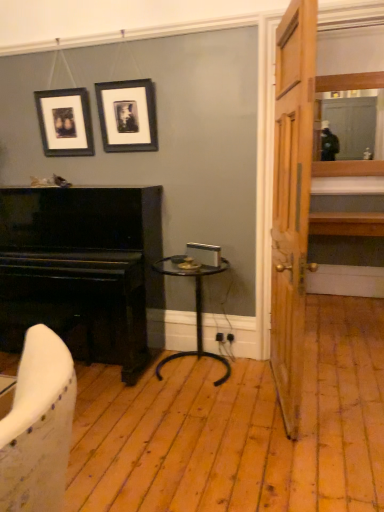
The image size is (384, 512). In order to click on free region under matte black picture frame at upper left, which is the first picture frame in left-to-right order (from a real-world perspective) in this screenshot , I will do `click(80, 185)`.